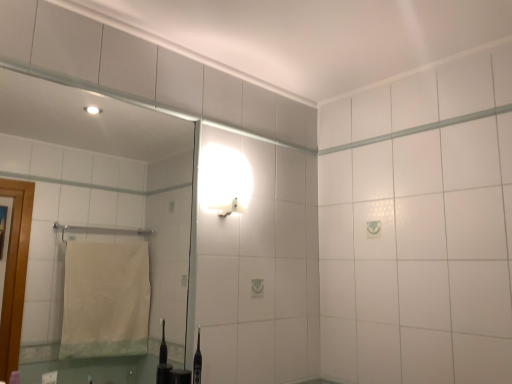
What do you see at coordinates (97, 213) in the screenshot?
I see `clear glass mirror at upper left` at bounding box center [97, 213].

Locate an element on the screen. The width and height of the screenshot is (512, 384). clear glass mirror at upper left is located at coordinates (97, 213).

This screenshot has height=384, width=512. What do you see at coordinates (224, 180) in the screenshot?
I see `white glossy wall sconce at upper center` at bounding box center [224, 180].

You are a GUI agent. You are given a task and a screenshot of the screen. Output one action in this format:
    pyautogui.click(x=<x>, y=<y>)
    Task: Click on the white glossy wall sconce at upper center
    
    Given the screenshot: What is the action you would take?
    pyautogui.click(x=224, y=180)

Locate an element on the screen. The height and width of the screenshot is (384, 512). clear glass mirror at upper left is located at coordinates (97, 213).

Between clear glass mirror at upper left and white glossy wall sconce at upper center, which one appears on the left side from the viewer's perspective?

clear glass mirror at upper left is more to the left.

Which object is further away from the camera taking this photo, clear glass mirror at upper left or white glossy wall sconce at upper center?

Positioned behind is white glossy wall sconce at upper center.

Is point (168, 317) farther from camera compared to point (240, 164)?

Yes, it is behind point (240, 164).

From the image's perspective, which object appears higher, clear glass mirror at upper left or white glossy wall sconce at upper center?

white glossy wall sconce at upper center.

From a real-world perspective, between clear glass mirror at upper left and white glossy wall sconce at upper center, who is vertically higher?

white glossy wall sconce at upper center, from a real-world perspective.

Considering the sizes of objects clear glass mirror at upper left and white glossy wall sconce at upper center in the image provided, who is thinner, clear glass mirror at upper left or white glossy wall sconce at upper center?

Thinner between the two is clear glass mirror at upper left.

Considering the sizes of objects clear glass mirror at upper left and white glossy wall sconce at upper center in the image provided, who is taller, clear glass mirror at upper left or white glossy wall sconce at upper center?

With more height is clear glass mirror at upper left.

Considering the sizes of clear glass mirror at upper left and white glossy wall sconce at upper center in the image, is clear glass mirror at upper left bigger or smaller than white glossy wall sconce at upper center?

Considering their sizes, clear glass mirror at upper left takes up more space than white glossy wall sconce at upper center.

Based on the photo, is clear glass mirror at upper left completely or partially outside of white glossy wall sconce at upper center?

clear glass mirror at upper left lies outside white glossy wall sconce at upper center's area.

Is clear glass mirror at upper left in contact with white glossy wall sconce at upper center?

No, clear glass mirror at upper left is not with white glossy wall sconce at upper center.

Does clear glass mirror at upper left turn towards white glossy wall sconce at upper center?

No, clear glass mirror at upper left is not aimed at white glossy wall sconce at upper center.

At what (x,y) coordinates should I click in order to perform the action: click on mirror in front of the white glossy wall sconce at upper center. Please return your answer as a coordinate pair (x, y). Looking at the image, I should click on (97, 213).

Considering the positions of objects white glossy wall sconce at upper center and clear glass mirror at upper left in the image provided, who is more to the left, white glossy wall sconce at upper center or clear glass mirror at upper left?

clear glass mirror at upper left is more to the left.

In the image, is white glossy wall sconce at upper center positioned in front of or behind clear glass mirror at upper left?

Visually, white glossy wall sconce at upper center is located behind clear glass mirror at upper left.

Which is behind, point (237, 172) or point (29, 107)?

The point (29, 107) is more distant.

From the image's perspective, which is below, white glossy wall sconce at upper center or clear glass mirror at upper left?

clear glass mirror at upper left.

From a real-world perspective, which object stands above the other?

From a 3D spatial view, white glossy wall sconce at upper center is above.

Is white glossy wall sconce at upper center thinner than clear glass mirror at upper left?

Incorrect, the width of white glossy wall sconce at upper center is not less than that of clear glass mirror at upper left.

Can you confirm if white glossy wall sconce at upper center is shorter than clear glass mirror at upper left?

Indeed, white glossy wall sconce at upper center has a lesser height compared to clear glass mirror at upper left.

Is white glossy wall sconce at upper center bigger than clear glass mirror at upper left?

No, white glossy wall sconce at upper center is not bigger than clear glass mirror at upper left.

Is white glossy wall sconce at upper center not inside clear glass mirror at upper left?

Yes, white glossy wall sconce at upper center is outside of clear glass mirror at upper left.

Is white glossy wall sconce at upper center directly adjacent to clear glass mirror at upper left?

No, white glossy wall sconce at upper center is not in contact with clear glass mirror at upper left.

Is white glossy wall sconce at upper center facing away from clear glass mirror at upper left?

No, white glossy wall sconce at upper center's orientation is not away from clear glass mirror at upper left.

Where is `mirror below the white glossy wall sconce at upper center (from the image's perspective)`? This screenshot has width=512, height=384. mirror below the white glossy wall sconce at upper center (from the image's perspective) is located at coordinates (97, 213).

Identify the location of mirror in front of the white glossy wall sconce at upper center. (97, 213).

The height and width of the screenshot is (384, 512). Find the location of `mirror below the white glossy wall sconce at upper center (from a real-world perspective)`. mirror below the white glossy wall sconce at upper center (from a real-world perspective) is located at coordinates (97, 213).